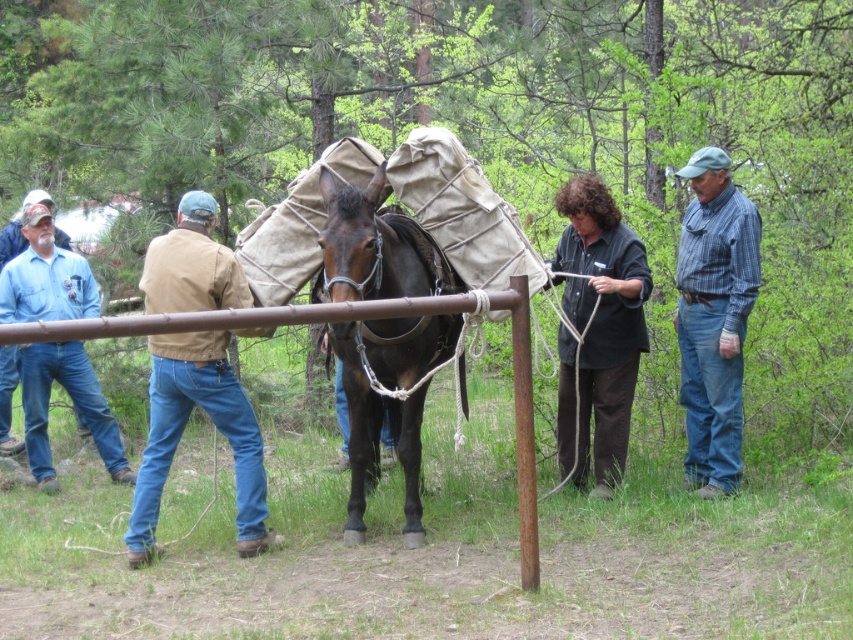
You are standing in the forest scene and want to determine which of the two points, point (363, 532) or point (38, 422), is closer to you. Based on the description, which point is nearer?

Point (363, 532) is closer to the viewer than point (38, 422).

You are standing at the point with coordinates point (x=387, y=403). What animal are you touching?

You are touching the brown matte horse at center because the point (x=387, y=403) is on the brown matte horse at center.

You are standing at the point marked by the coordinates point (183,429) in the image. What object is located at this point?

The point (183,429) marks the brown canvas jacket at left.